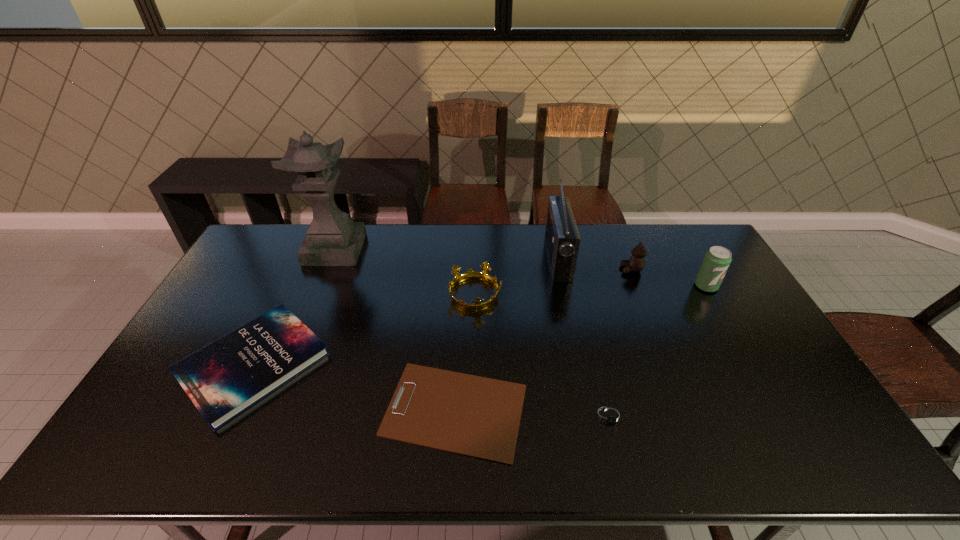
Locate an element on the screen. vacant space that satisfies the following two spatial constraints: 1. on the front-facing side of the radio receiver; 2. on the right side of the sixth shortest object is located at coordinates (564, 286).

Locate an element on the screen. This screenshot has height=540, width=960. vacant point that satisfies the following two spatial constraints: 1. on the front-facing side of the sixth shortest object; 2. on the left side of the second tallest object is located at coordinates (564, 286).

Image resolution: width=960 pixels, height=540 pixels. In order to click on free location that satisfies the following two spatial constraints: 1. on the back side of the fourth shortest object; 2. on the right side of the rightmost object in this screenshot , I will do coord(475,286).

This screenshot has width=960, height=540. I want to click on vacant region that satisfies the following two spatial constraints: 1. at the front opening of the sculpture; 2. on the right side of the fourth shortest object, so click(x=317, y=294).